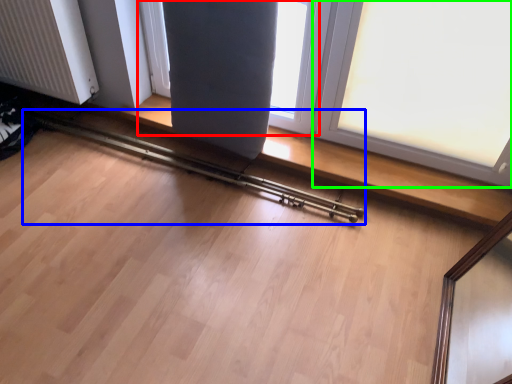
Question: Which is nearer to the window (highlighted by a red box)? rail (highlighted by a blue box) or window (highlighted by a green box).

Choices:
 (A) rail
 (B) window

Answer: (B)